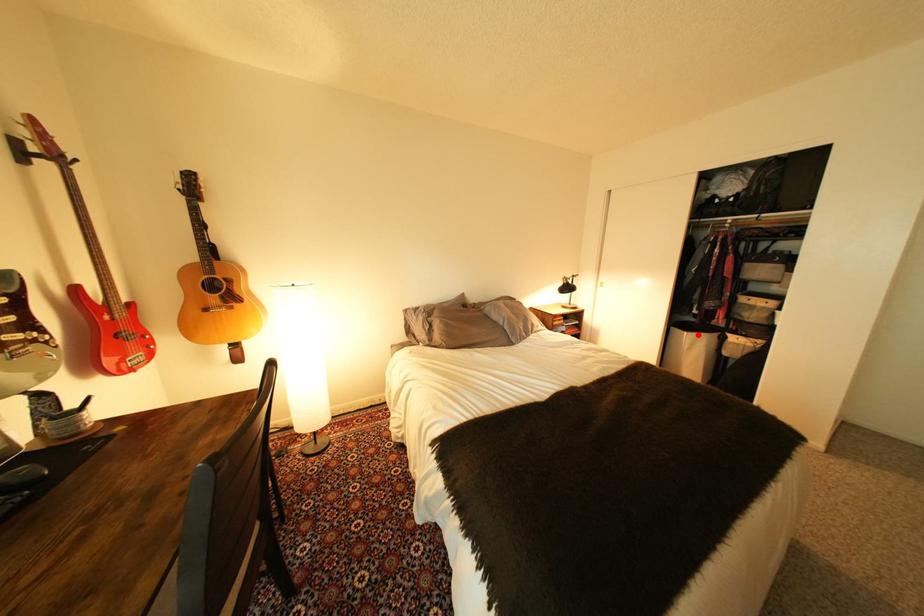
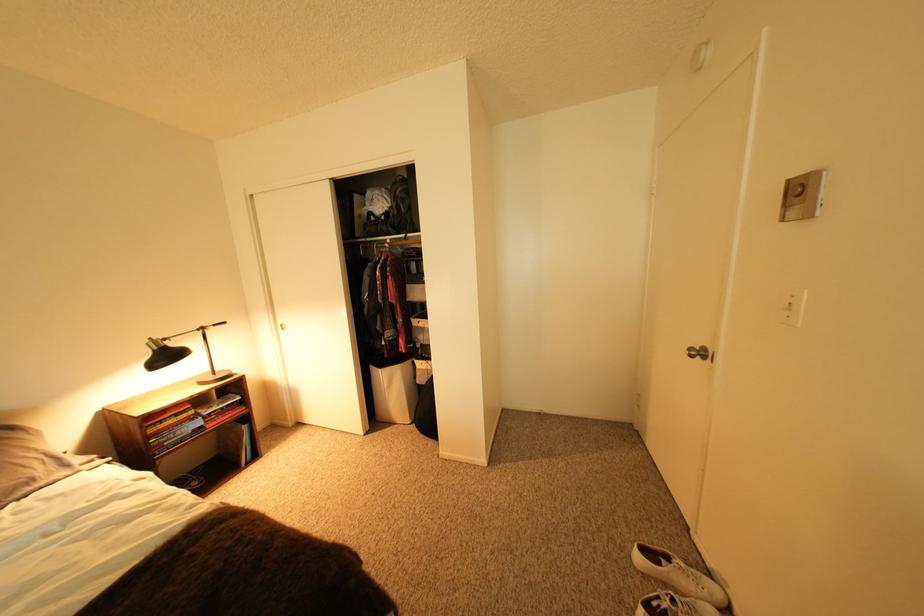
Question: I am providing you with two images of the same scene from different viewpoints. In image1, a red point is highlighted. Considering the same 3D point in image2, which of the following is correct?

Choices:
 (A) It is closer
 (B) It is farther

Answer: (B)